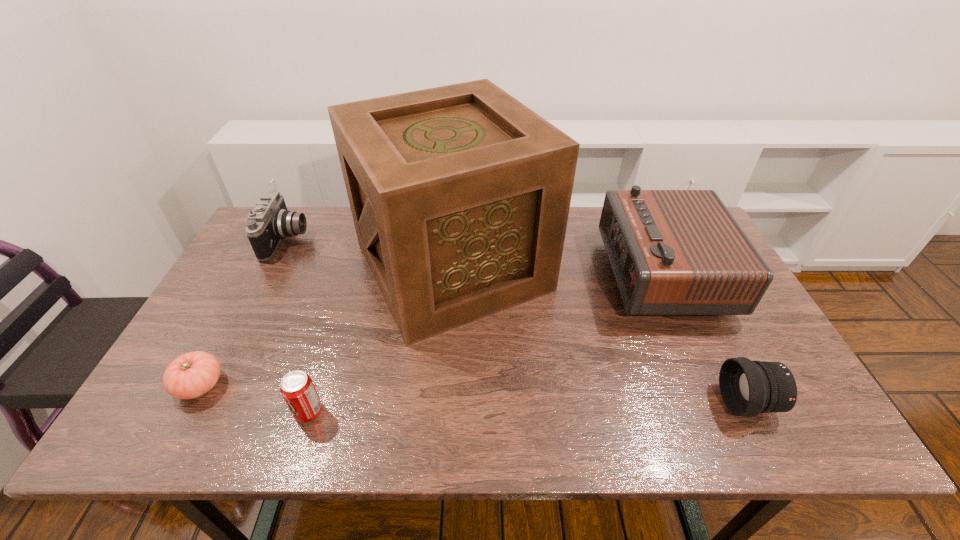
Identify the location of vacant space located on the front-facing side of the camera. The height and width of the screenshot is (540, 960). 356,240.

The image size is (960, 540). In order to click on free space located at the front element of the telephoto lens in this screenshot , I will do `click(635, 402)`.

Identify the location of vacant space located 0.300m at the front element of the telephoto lens. (590, 402).

In order to click on free region located at the front element of the telephoto lens in this screenshot , I will do `click(564, 402)`.

I want to click on free space located on the back of the soda, so click(334, 332).

Find the location of a particular element. blank space located on the right of the tomato is located at coordinates (314, 385).

Locate an element on the screen. box present at the far edge is located at coordinates (460, 194).

You are a GUI agent. You are given a task and a screenshot of the screen. Output one action in this format:
    pyautogui.click(x=<x>, y=<y>)
    Task: Click on the radio receiver positioned at the far edge
    This screenshot has width=960, height=540.
    Given the screenshot: What is the action you would take?
    pyautogui.click(x=673, y=252)

Image resolution: width=960 pixels, height=540 pixels. Identify the location of camera located at the far edge. (270, 221).

Identify the location of telephoto lens at the near edge. The image size is (960, 540). (748, 388).